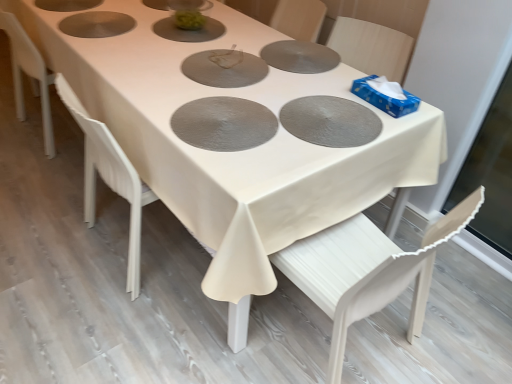
Where is `vacant space to the right of white wood chair at lower right`? Image resolution: width=512 pixels, height=384 pixels. vacant space to the right of white wood chair at lower right is located at coordinates (451, 327).